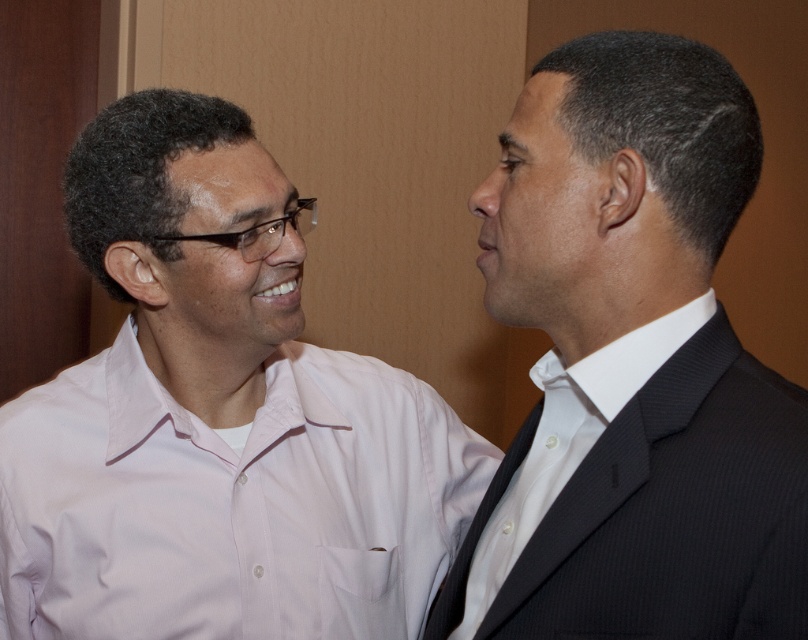
Can you confirm if pink cotton shirt at left is smaller than black suit at right?

No, pink cotton shirt at left is not smaller than black suit at right.

Between pink cotton shirt at left and black suit at right, which one is positioned higher?

black suit at right

Does point (222, 372) come farther from viewer compared to point (491, 189)?

Yes, point (222, 372) is farther from viewer.

Find the location of a particular element. The height and width of the screenshot is (640, 808). pink cotton shirt at left is located at coordinates (217, 419).

This screenshot has height=640, width=808. Identify the location of black suit at right. (630, 365).

Which is above, black suit at right or white smooth shirt at right?

black suit at right is higher up.

Measure the distance between black suit at right and camera.

black suit at right and camera are 23.80 inches apart.

This screenshot has height=640, width=808. What are the coordinates of `black suit at right` in the screenshot? It's located at (630, 365).

Is pink cotton shirt at left in front of white smooth shirt at right?

No, pink cotton shirt at left is behind white smooth shirt at right.

Does pink cotton shirt at left have a greater width compared to white smooth shirt at right?

Yes, pink cotton shirt at left is wider than white smooth shirt at right.

Is point (242, 630) positioned before point (642, 324)?

No, it is behind (642, 324).

You are a GUI agent. You are given a task and a screenshot of the screen. Output one action in this format:
    pyautogui.click(x=<x>, y=<y>)
    Task: Click on the pink cotton shirt at left
    The width and height of the screenshot is (808, 640).
    Given the screenshot: What is the action you would take?
    pyautogui.click(x=217, y=419)